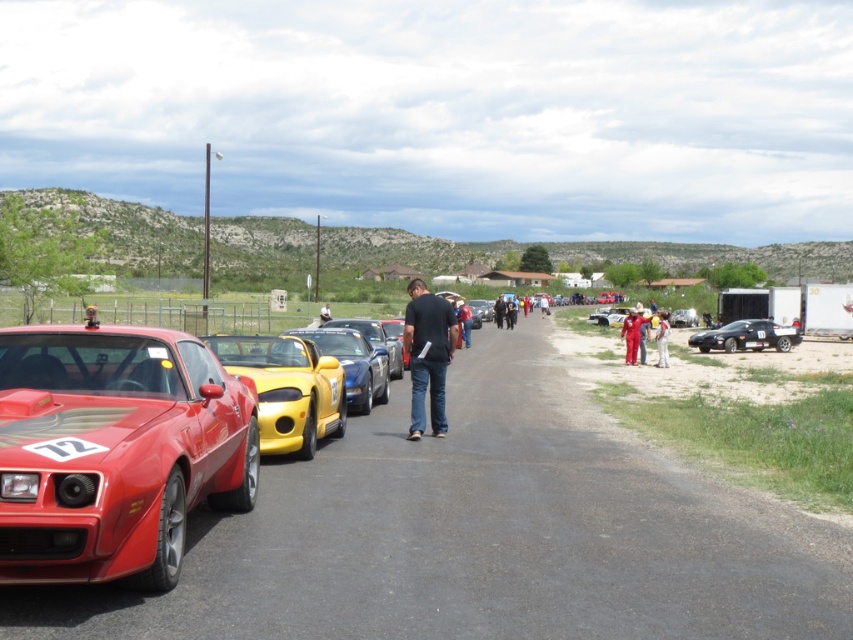
Does shiny yellow convertible at center have a lesser height compared to white cotton shirt at right?

Correct, shiny yellow convertible at center is not as tall as white cotton shirt at right.

Can you confirm if shiny yellow convertible at center is positioned to the left of white cotton shirt at right?

Indeed, shiny yellow convertible at center is positioned on the left side of white cotton shirt at right.

Between point (341, 435) and point (660, 349), which one is positioned in front?

Point (341, 435) is more forward.

Locate an element on the screen. This screenshot has width=853, height=640. shiny yellow convertible at center is located at coordinates (287, 388).

Between metallic silver car at center and blue denim jeans at center, which one is positioned higher?

metallic silver car at center is higher up.

Between point (596, 321) and point (467, 307), which one is positioned behind?

Positioned behind is point (596, 321).

The width and height of the screenshot is (853, 640). What are the coordinates of `metallic silver car at center` in the screenshot? It's located at (608, 316).

What do you see at coordinates (352, 364) in the screenshot? I see `shiny yellow car at center` at bounding box center [352, 364].

Which is more to the left, shiny yellow car at center or blue denim jeans at center?

shiny yellow car at center is more to the left.

Measure the distance between point (x=335, y=340) and camera.

15.40 meters

In order to click on shiny yellow car at center in this screenshot , I will do `click(352, 364)`.